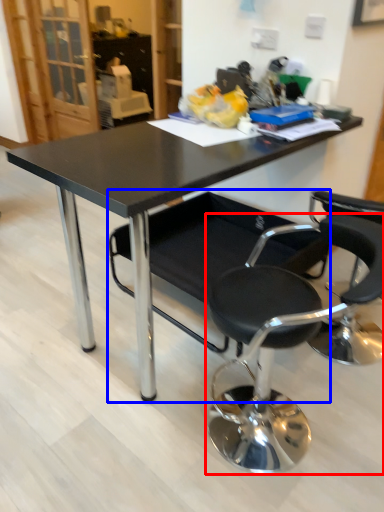
Question: Which point is closer to the camera, chair (highlighted by a red box) or chair (highlighted by a blue box)?

Choices:
 (A) chair
 (B) chair

Answer: (A)